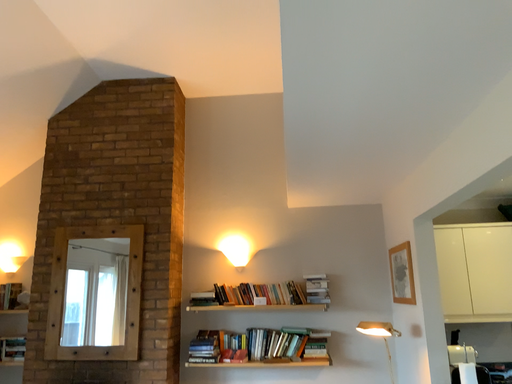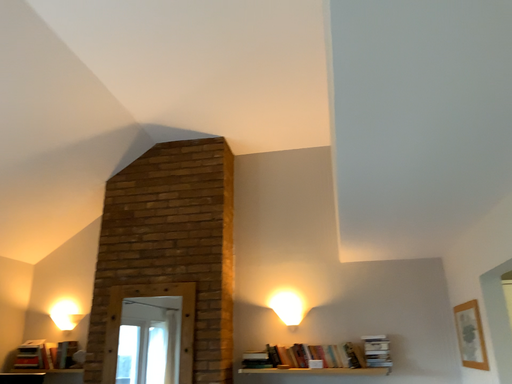
Question: Which way did the camera rotate in the video?

Choices:
 (A) rotated left
 (B) rotated right

Answer: (A)